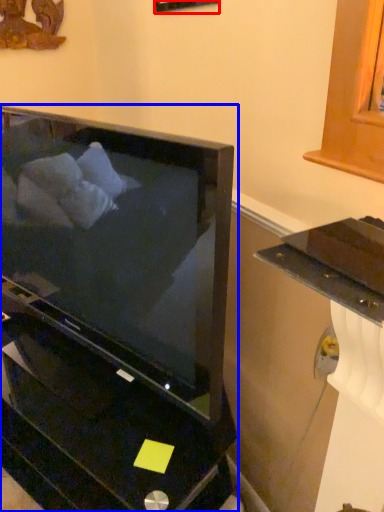
Question: Which point is further to the camera, picture frame (highlighted by a red box) or furniture (highlighted by a blue box)?

Choices:
 (A) picture frame
 (B) furniture

Answer: (A)